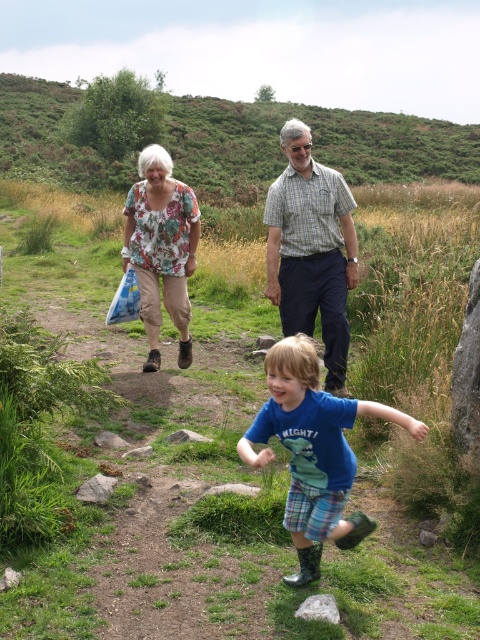
Question: Is the position of green grassy hillside at upper center more distant than that of checkered fabric shirt at center?

Choices:
 (A) yes
 (B) no

Answer: (A)

Question: Is green grassy at center wider than blue rubber boots at center?

Choices:
 (A) no
 (B) yes

Answer: (B)

Question: Which of these objects is positioned farthest from the green grassy hillside at upper center?

Choices:
 (A) checkered fabric shirt at center
 (B) floral blouse at center
 (C) blue rubber boots at center

Answer: (B)

Question: Can you confirm if green grassy hillside at upper center is bigger than checkered fabric shirt at center?

Choices:
 (A) no
 (B) yes

Answer: (B)

Question: Which of the following is the farthest from the observer?

Choices:
 (A) green grassy at center
 (B) floral blouse at center
 (C) checkered fabric shirt at center
 (D) blue rubber boots at center

Answer: (B)

Question: Estimate the real-world distances between objects in this image. Which object is farther from the green grassy hillside at upper center?

Choices:
 (A) floral blouse at center
 (B) green grassy at center

Answer: (A)